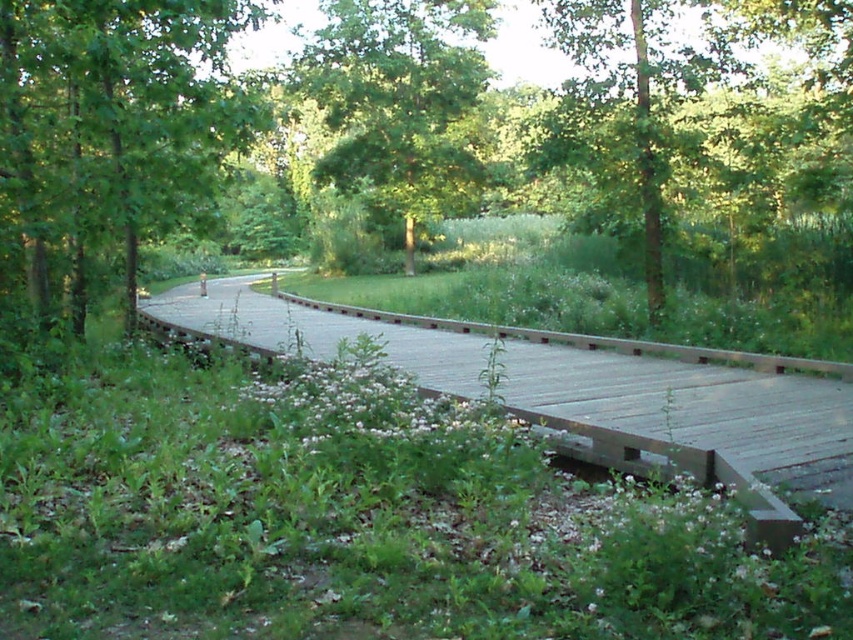
Who is taller, green leafy tree at upper center or green leafy tree at center?

green leafy tree at upper center

The height and width of the screenshot is (640, 853). What do you see at coordinates (700, 104) in the screenshot? I see `green leafy tree at upper center` at bounding box center [700, 104].

Is point (711, 116) behind point (450, 108)?

No, (711, 116) is in front of (450, 108).

Find the location of a particular element. This screenshot has width=853, height=640. green leafy tree at upper center is located at coordinates (700, 104).

Which is behind, point (830, 420) or point (374, 122)?

Positioned behind is point (374, 122).

Which is in front, point (822, 467) or point (409, 269)?

Point (822, 467)

The image size is (853, 640). I want to click on wooden bridge at center, so 589,392.

Can you confirm if green matte tree at left is thinner than green leafy tree at center?

Yes, green matte tree at left is thinner than green leafy tree at center.

Who is taller, green matte tree at left or green leafy tree at center?

green leafy tree at center is taller.

Locate an element on the screen. Image resolution: width=853 pixels, height=640 pixels. green matte tree at left is located at coordinates (108, 140).

The width and height of the screenshot is (853, 640). Find the location of `green matte tree at left`. green matte tree at left is located at coordinates (108, 140).